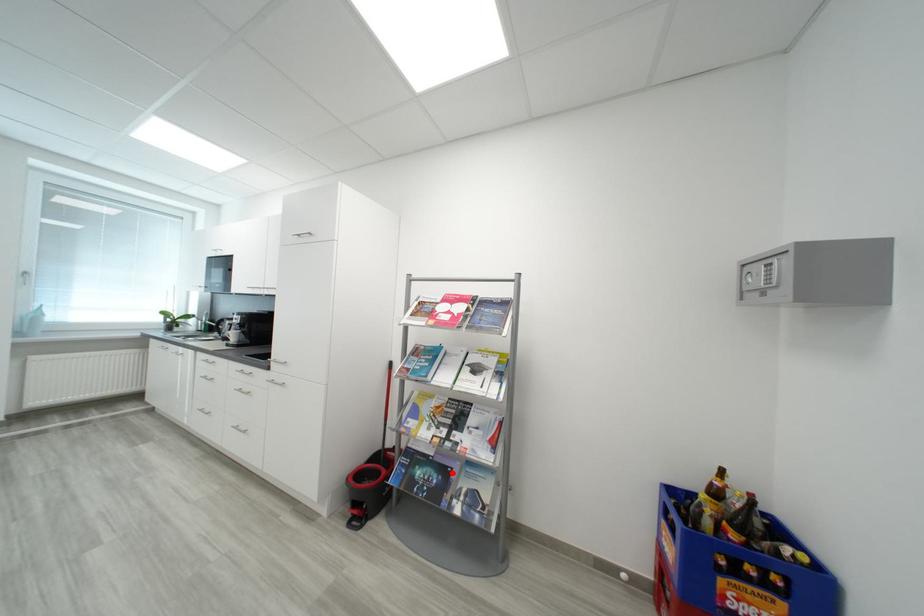
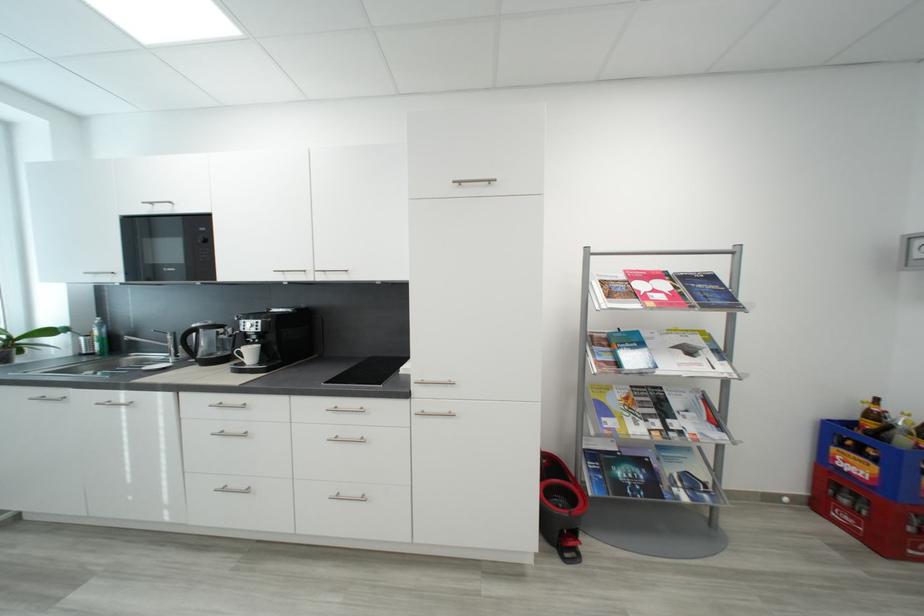
Question: A red point is marked in image1. In image2, is the corresponding 3D point closer to the camera or farther? Reply with the corresponding letter.

Choices:
 (A) The corresponding 3D point is closer.
 (B) The corresponding 3D point is farther.

Answer: (A)